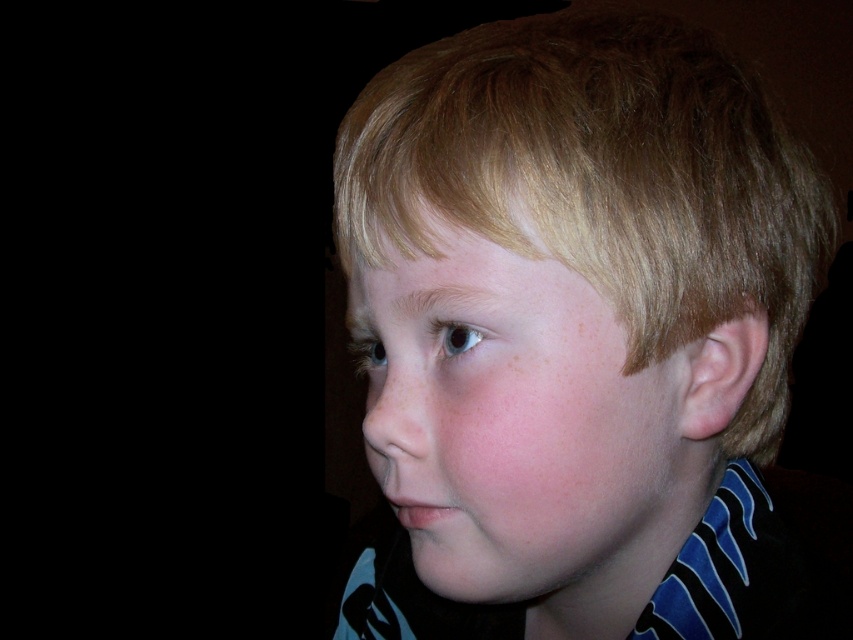
Is smooth skin child at center below pink matte freckle at upper center?

Correct, smooth skin child at center is located below pink matte freckle at upper center.

Which is below, smooth skin child at center or pink matte freckle at upper center?

Positioned lower is smooth skin child at center.

The image size is (853, 640). Describe the element at coordinates (573, 332) in the screenshot. I see `smooth skin child at center` at that location.

Image resolution: width=853 pixels, height=640 pixels. I want to click on smooth skin child at center, so click(573, 332).

Looking at this image, who is positioned more to the left, smooth skin child at center or smooth skin face at center?

smooth skin face at center

Is point (465, 48) positioned in front of point (575, 556)?

No, it is behind (575, 556).

Where is `smooth skin child at center`? Image resolution: width=853 pixels, height=640 pixels. smooth skin child at center is located at coordinates (573, 332).

Is smooth skin face at center thinner than pink matte freckle at upper center?

No, smooth skin face at center is not thinner than pink matte freckle at upper center.

Who is more forward, (595, 330) or (508, 364)?

Point (595, 330)

Between point (579, 298) and point (511, 349), which one is positioned in front?

Point (579, 298) is in front.

What are the coordinates of `smooth skin face at center` in the screenshot? It's located at (519, 428).